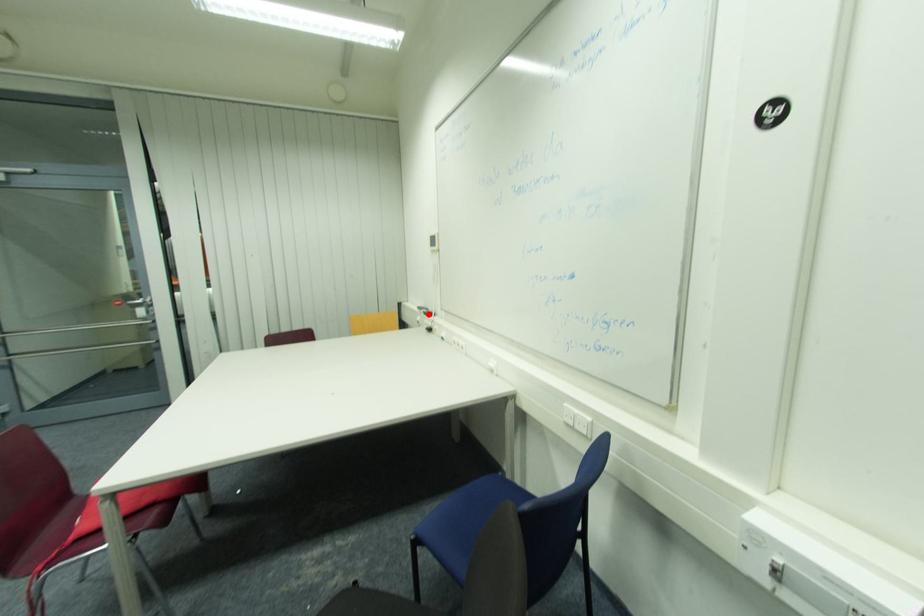
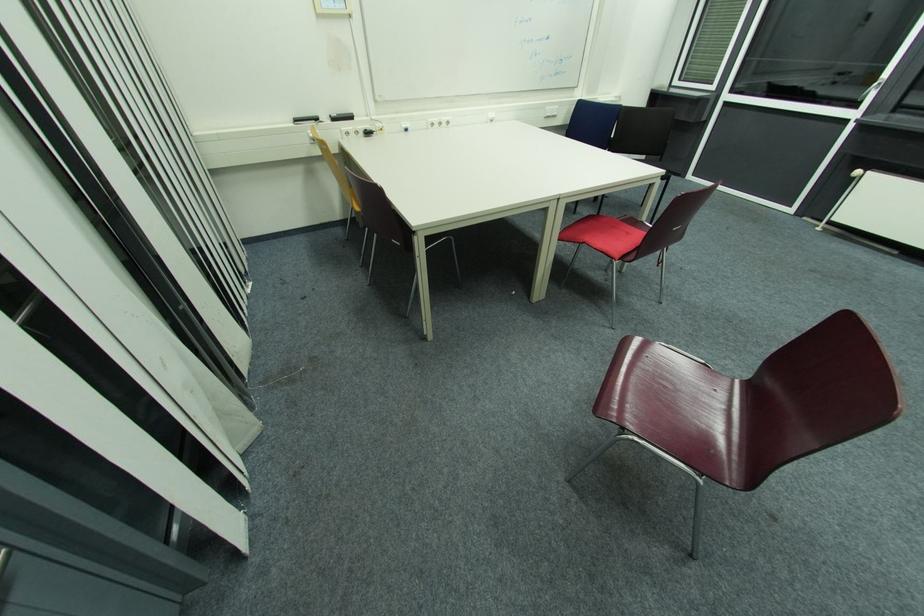
Question: I am providing you with two images of the same scene from different viewpoints. A red point is shown in image1. For the corresponding object point in image2, is it positioned nearer or farther from the camera?

Choices:
 (A) Nearer
 (B) Farther

Answer: (A)